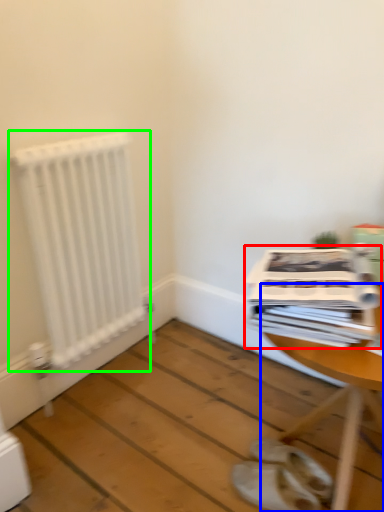
Question: Which is farther away from magazine (highlighted by a red box)? table (highlighted by a blue box) or radiator (highlighted by a green box)?

Choices:
 (A) table
 (B) radiator

Answer: (B)